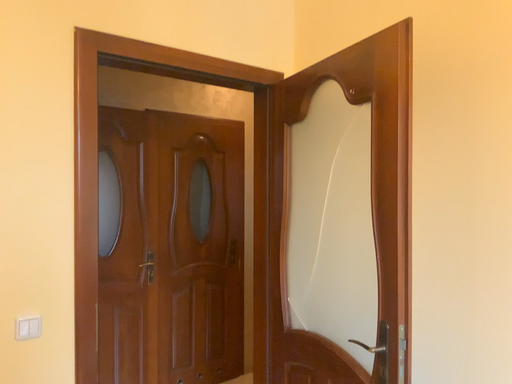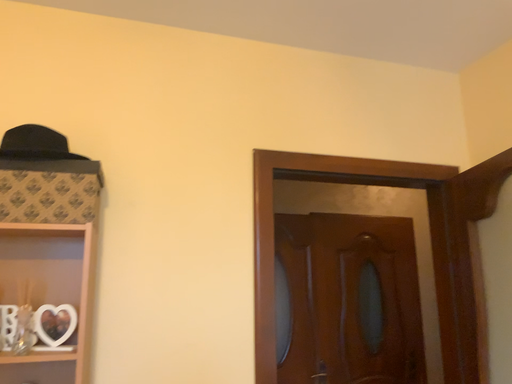
Question: Which way did the camera rotate in the video?

Choices:
 (A) rotated left
 (B) rotated right

Answer: (A)